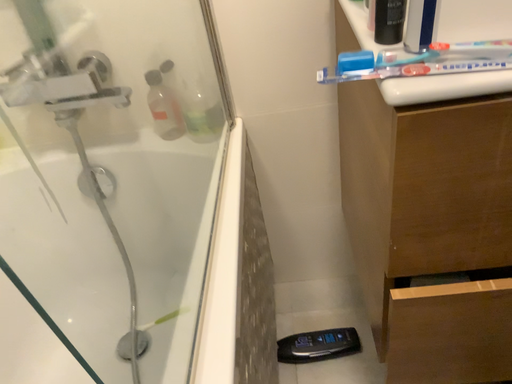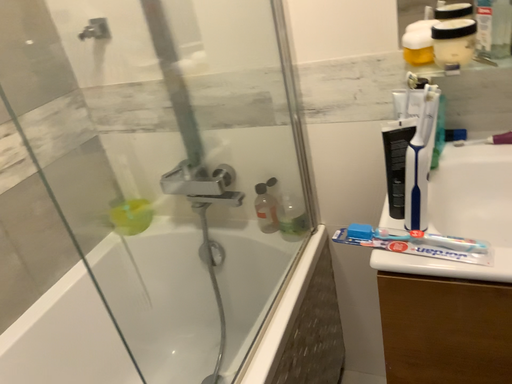
Question: How did the camera likely rotate when shooting the video?

Choices:
 (A) rotated right
 (B) rotated left

Answer: (B)